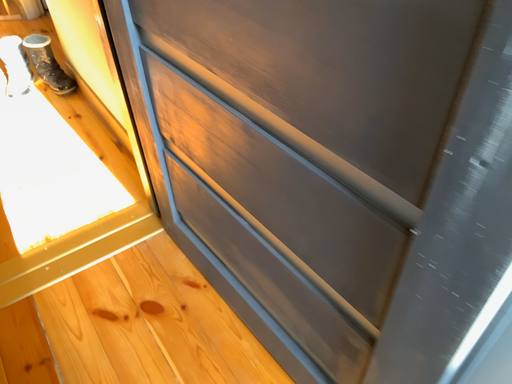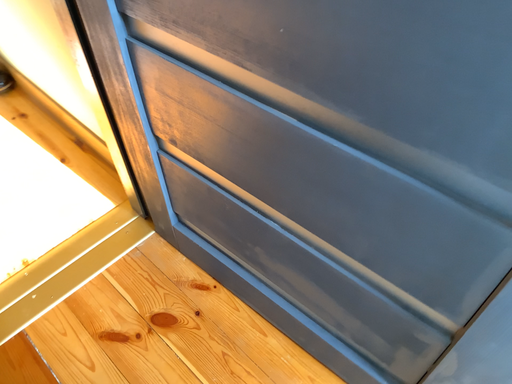
Question: Which way did the camera rotate in the video?

Choices:
 (A) rotated left
 (B) rotated right

Answer: (B)